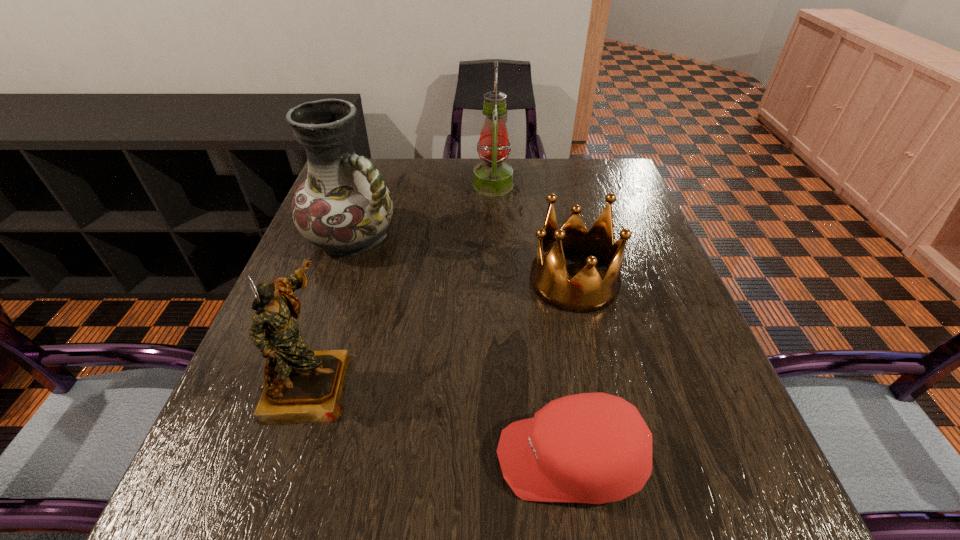
Find the location of a particular element. The image size is (960, 540). free spot located 0.190m on the front-facing side of the shortest object is located at coordinates click(376, 458).

Image resolution: width=960 pixels, height=540 pixels. I want to click on vacant space situated on the front-facing side of the shortest object, so click(x=364, y=458).

Locate an element on the screen. object that is at the far edge is located at coordinates (493, 177).

Locate an element on the screen. Image resolution: width=960 pixels, height=540 pixels. object present at the near edge is located at coordinates (595, 448).

At what (x,y) coordinates should I click in order to perform the action: click on vase that is positioned at the left edge. Please return your answer as a coordinate pair (x, y). Looking at the image, I should click on (344, 206).

Identify the location of figurine at the left edge. The image size is (960, 540). (301, 385).

Where is `object at the right edge`? This screenshot has height=540, width=960. object at the right edge is located at coordinates (586, 292).

In the image, there is a desktop. What are the coordinates of `free space at the far edge` in the screenshot? It's located at (486, 197).

The height and width of the screenshot is (540, 960). In the image, there is a desktop. What are the coordinates of `blank space at the near edge` in the screenshot? It's located at (300, 518).

In the image, there is a desktop. Where is `vacant space at the left edge`? This screenshot has width=960, height=540. vacant space at the left edge is located at coordinates (338, 293).